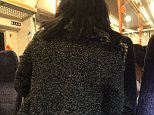
The width and height of the screenshot is (154, 115). What are the coordinates of `entry` in the screenshot? It's located at (2, 45).